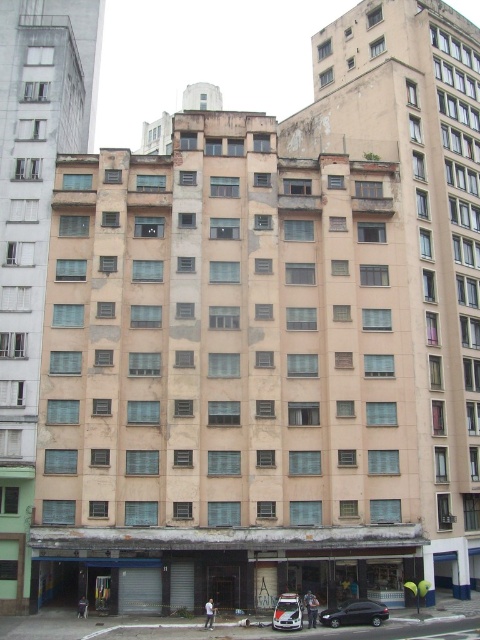
Question: Is black glossy car at lower center behind white glossy car at center?

Choices:
 (A) no
 (B) yes

Answer: (B)

Question: Is black glossy car at lower center to the right of white glossy car at center from the viewer's perspective?

Choices:
 (A) yes
 (B) no

Answer: (A)

Question: Is black glossy car at lower center wider than white glossy car at center?

Choices:
 (A) no
 (B) yes

Answer: (B)

Question: Among these objects, which one is nearest to the camera?

Choices:
 (A) white glossy car at center
 (B) black glossy car at lower center

Answer: (A)